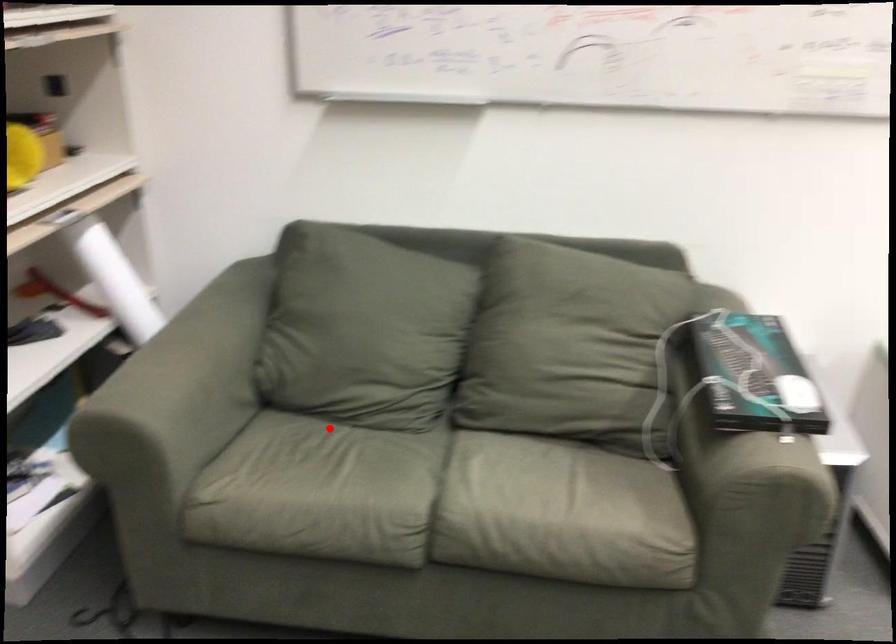
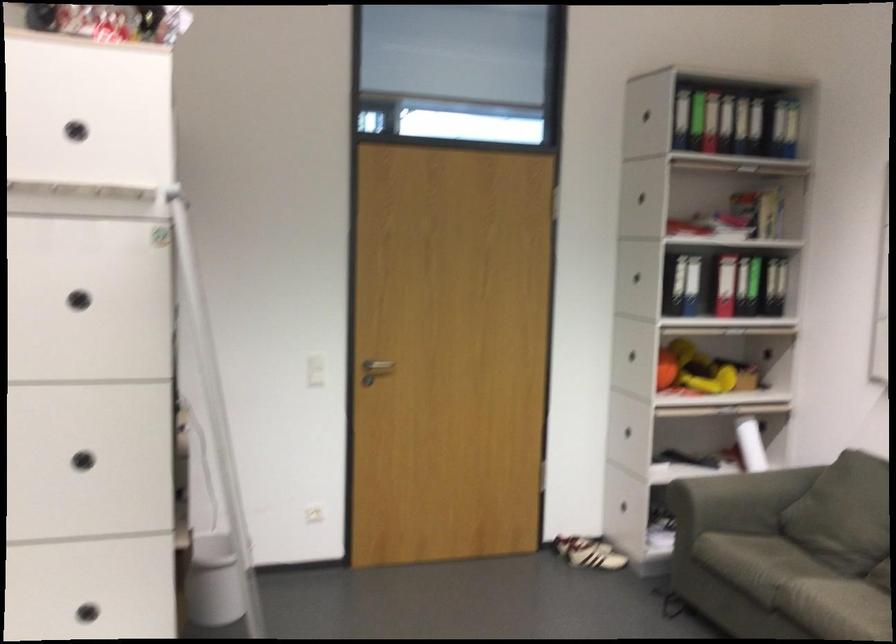
The point at the highlighted location is marked in the first image. Where is the corresponding point in the second image?

(787, 550)